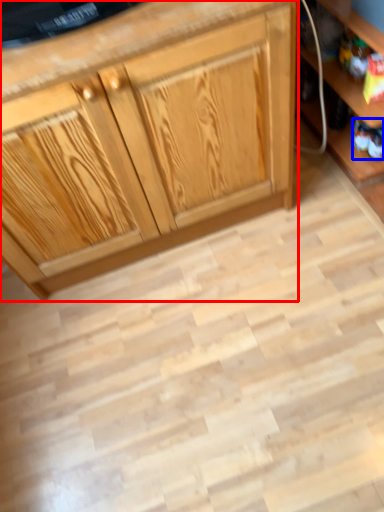
Question: Which of the following is the closest to the observer, cabinetry (highlighted by a red box) or toy (highlighted by a blue box)?

Choices:
 (A) cabinetry
 (B) toy

Answer: (A)